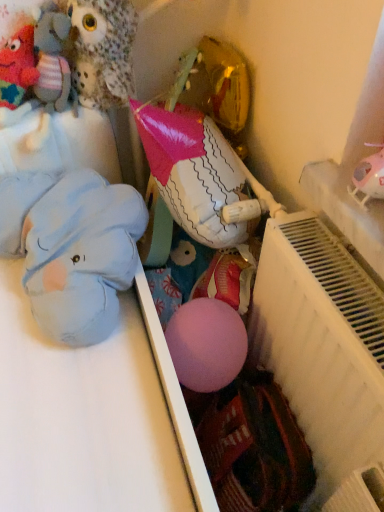
Question: Is the depth of fluffy fabric owl at upper left, placed as the 1th toy when sorted from top to bottom, less than that of blue plush elephant at left, arranged as the 1th toy when ordered from the bottom?

Choices:
 (A) no
 (B) yes

Answer: (A)

Question: From a real-world perspective, is fluffy fabric owl at upper left, the 4th toy ordered from the bottom, beneath blue plush elephant at left, which is counted as the 4th toy, starting from the top?

Choices:
 (A) yes
 (B) no

Answer: (B)

Question: Is the position of fluffy fabric owl at upper left, the 4th toy ordered from the bottom, more distant than that of blue plush elephant at left, arranged as the 1th toy when ordered from the bottom?

Choices:
 (A) no
 (B) yes

Answer: (B)

Question: From the image's perspective, is fluffy fabric owl at upper left, placed as the 1th toy when sorted from top to bottom, on blue plush elephant at left, arranged as the 1th toy when ordered from the bottom?

Choices:
 (A) yes
 (B) no

Answer: (A)

Question: Is fluffy fabric owl at upper left, the 4th toy ordered from the bottom, shorter than blue plush elephant at left, which is counted as the 4th toy, starting from the top?

Choices:
 (A) no
 (B) yes

Answer: (A)

Question: Is fluffy fabric owl at upper left, the 4th toy ordered from the bottom, aimed at blue plush elephant at left, which is counted as the 4th toy, starting from the top?

Choices:
 (A) no
 (B) yes

Answer: (A)

Question: Can you confirm if blue plush elephant at left, arranged as the 1th toy when ordered from the bottom, is wider than fluffy fabric owl at upper left, placed as the 1th toy when sorted from top to bottom?

Choices:
 (A) no
 (B) yes

Answer: (B)

Question: Is blue plush elephant at left, which is counted as the 4th toy, starting from the top, in front of fluffy fabric owl at upper left, placed as the 1th toy when sorted from top to bottom?

Choices:
 (A) yes
 (B) no

Answer: (A)

Question: Does blue plush elephant at left, arranged as the 1th toy when ordered from the bottom, appear on the right side of fluffy fabric owl at upper left, the 4th toy ordered from the bottom?

Choices:
 (A) no
 (B) yes

Answer: (A)

Question: Is blue plush elephant at left, arranged as the 1th toy when ordered from the bottom, behind fluffy fabric owl at upper left, the 4th toy ordered from the bottom?

Choices:
 (A) no
 (B) yes

Answer: (A)

Question: Is blue plush elephant at left, arranged as the 1th toy when ordered from the bottom, beside fluffy fabric owl at upper left, placed as the 1th toy when sorted from top to bottom?

Choices:
 (A) no
 (B) yes

Answer: (A)

Question: Would you say blue plush elephant at left, which is counted as the 4th toy, starting from the top, contains fluffy fabric owl at upper left, the 4th toy ordered from the bottom?

Choices:
 (A) yes
 (B) no

Answer: (B)

Question: From the image's perspective, is blue plush elephant at left, arranged as the 1th toy when ordered from the bottom, on white matte radiator at right?

Choices:
 (A) no
 (B) yes

Answer: (B)